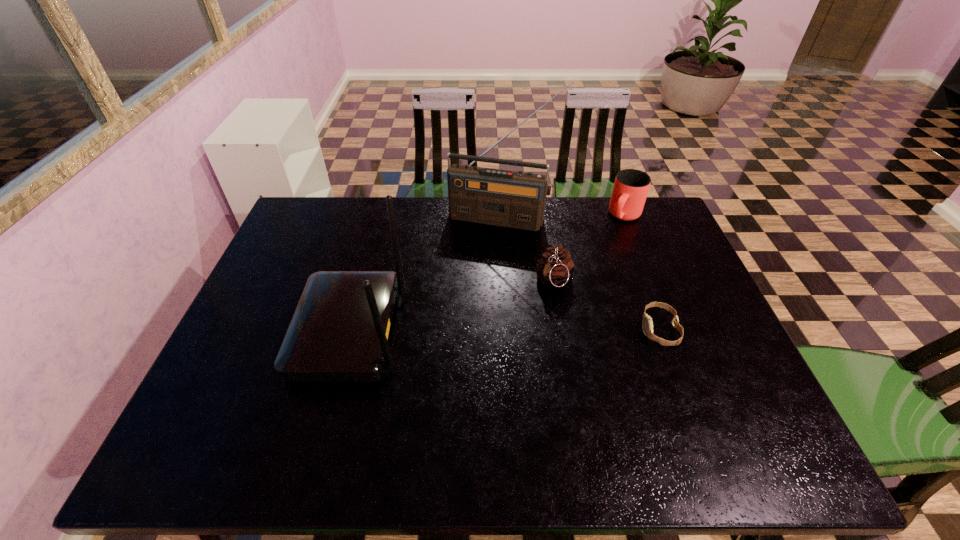
Where is `the second tallest object`? Image resolution: width=960 pixels, height=540 pixels. the second tallest object is located at coordinates (339, 332).

The image size is (960, 540). Find the location of `router`. router is located at coordinates (339, 332).

The height and width of the screenshot is (540, 960). I want to click on watch, so click(647, 325).

Where is `cup`? cup is located at coordinates (631, 186).

This screenshot has height=540, width=960. In order to click on the tallest object in this screenshot , I will do [x=505, y=198].

At what (x,y) coordinates should I click in order to perform the action: click on pinecone. Please return your answer as a coordinate pair (x, y). Image resolution: width=960 pixels, height=540 pixels. Looking at the image, I should click on (555, 267).

Find the location of a particular element. vacant space positioned on the front-facing side of the router is located at coordinates (249, 331).

Identify the location of vacant space located on the front-facing side of the router. (268, 331).

The height and width of the screenshot is (540, 960). Find the location of `free space located 0.130m on the front-facing side of the router`. free space located 0.130m on the front-facing side of the router is located at coordinates (249, 331).

This screenshot has width=960, height=540. Find the location of `vacant space located on the face of the shortest object`. vacant space located on the face of the shortest object is located at coordinates (526, 330).